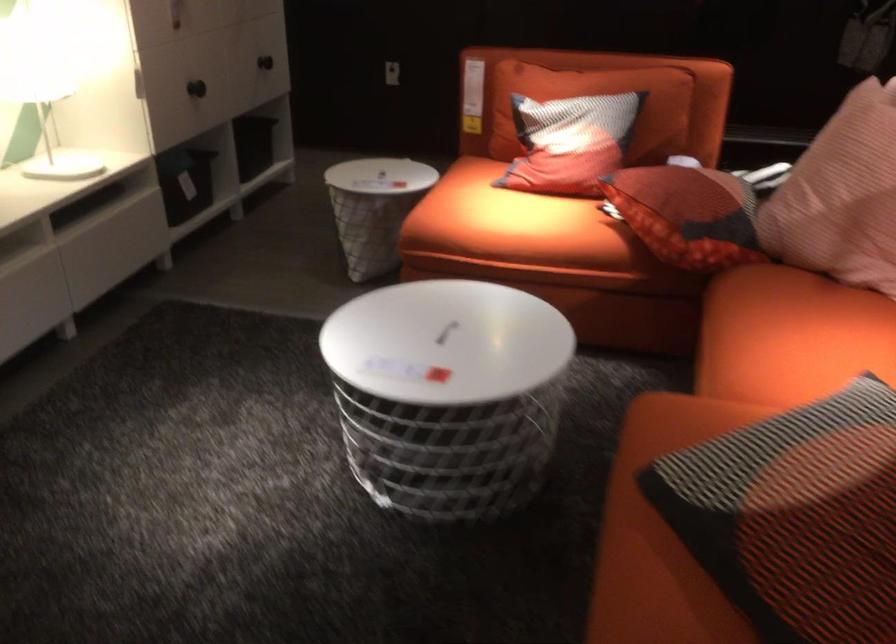
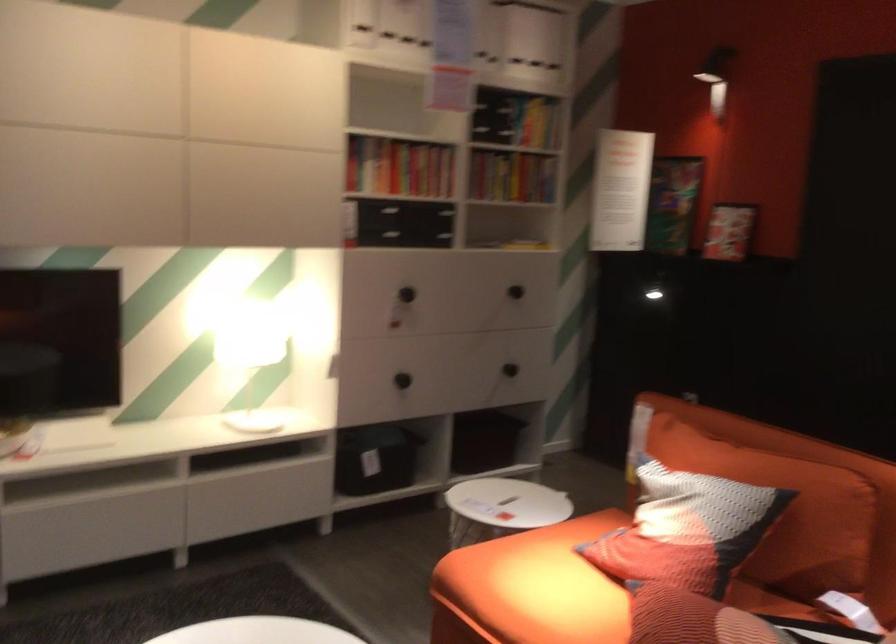
Where in the second image is the point corresponding to point (597, 136) from the first image?

(686, 529)